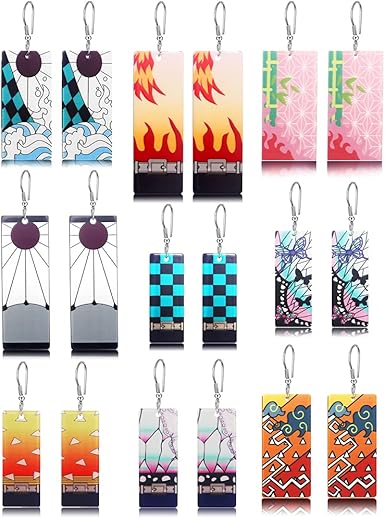
Where is `hook`? This screenshot has width=385, height=517. hook is located at coordinates (284, 367).